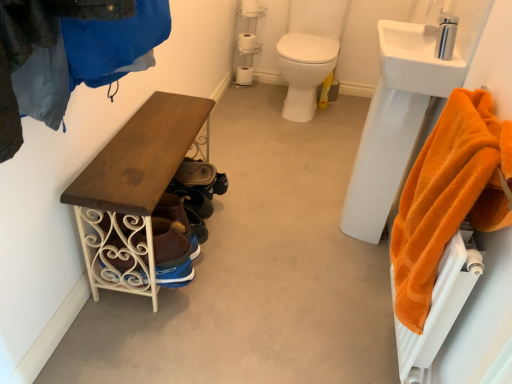
Where is `free spot in front of wooden bench at left`? free spot in front of wooden bench at left is located at coordinates (170, 339).